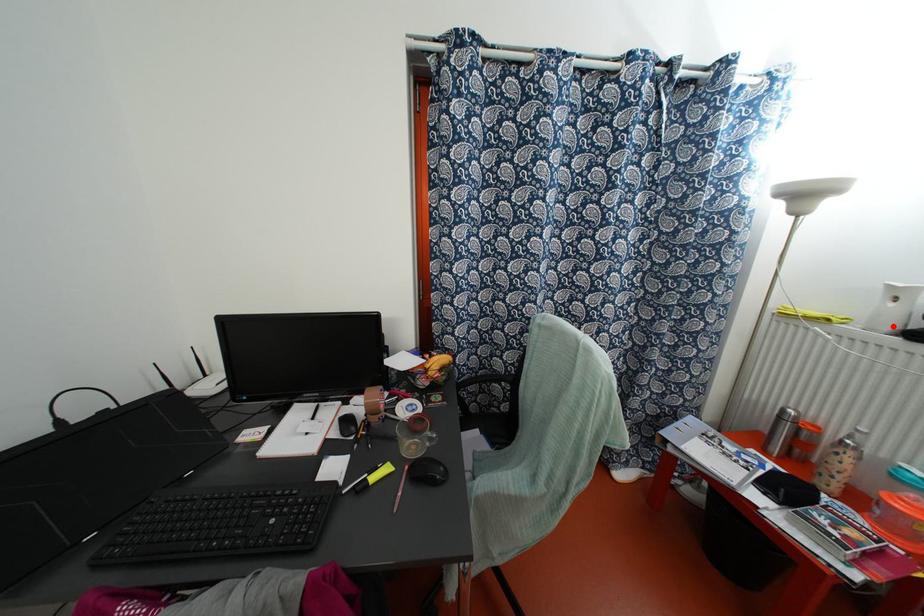
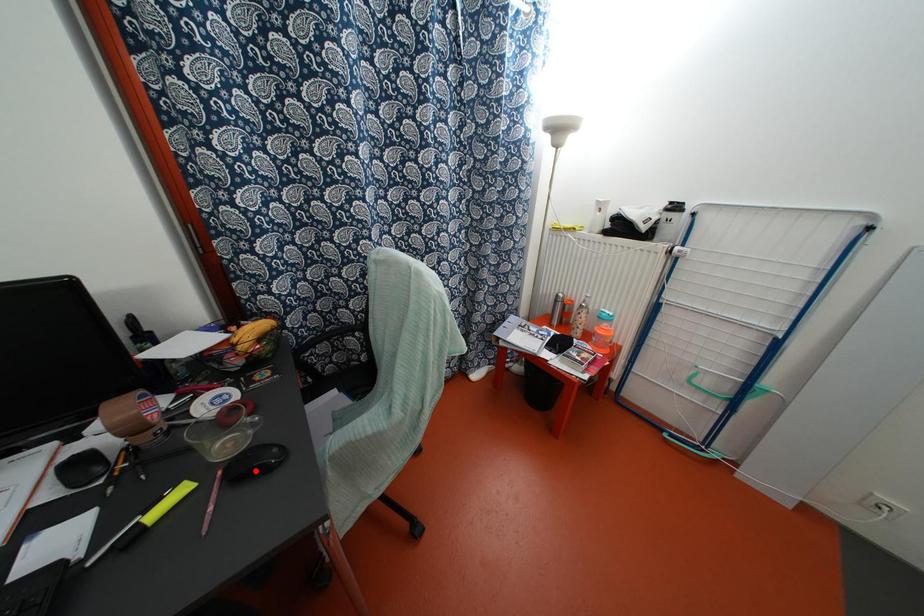
From the picture: I am providing you with two images of the same scene from different viewpoints. A red point is marked on the first image and another point is marked on the second image. Is the red point in image1 aligned with the point shown in image2?

No